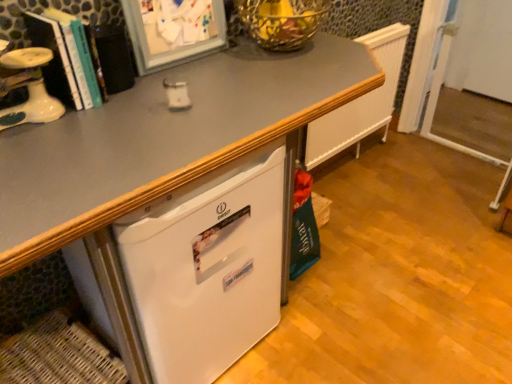
Locate an element on the screen. The width and height of the screenshot is (512, 384). white glossy desk at center is located at coordinates (162, 139).

What do you see at coordinates (162, 139) in the screenshot? The height and width of the screenshot is (384, 512). I see `white glossy desk at center` at bounding box center [162, 139].

Locate an element on the screen. The height and width of the screenshot is (384, 512). white plastic screen door at right is located at coordinates (474, 83).

The image size is (512, 384). Find the location of `white textured radiator at upper right`. white textured radiator at upper right is located at coordinates (361, 102).

Measure the distance between point (386, 62) and camera.

Point (386, 62) and camera are 7.99 feet apart.

Find the location of `white glossy desk at center`. white glossy desk at center is located at coordinates (162, 139).

Which is behind, white plastic screen door at right or white textured radiator at upper right?

white plastic screen door at right.

Consider the image. Is white plastic screen door at right surrounding white textured radiator at upper right?

That's incorrect, white textured radiator at upper right is not inside white plastic screen door at right.

Does point (498, 94) appear closer or farther from the camera than point (334, 139)?

Point (498, 94) is farther from the camera than point (334, 139).

Is white plastic screen door at right at the right side of white textured radiator at upper right?

Correct, you'll find white plastic screen door at right to the right of white textured radiator at upper right.

Measure the distance from white textured radiator at upper right to woven brown basket at lower left.

white textured radiator at upper right is 1.59 meters away from woven brown basket at lower left.

Is point (395, 54) closer to viewer compared to point (36, 376)?

No.

Considering the positions of objects white textured radiator at upper right and woven brown basket at lower left in the image provided, who is more to the right, white textured radiator at upper right or woven brown basket at lower left?

From the viewer's perspective, white textured radiator at upper right appears more on the right side.

Which of these two, white textured radiator at upper right or woven brown basket at lower left, is bigger?

white textured radiator at upper right is bigger.

Who is taller, woven brown basket at lower left or white plastic screen door at right?

Standing taller between the two is white plastic screen door at right.

Is woven brown basket at lower left touching white plastic screen door at right?

There is a gap between woven brown basket at lower left and white plastic screen door at right.

From the image's perspective, relative to white plastic screen door at right, is woven brown basket at lower left above or below?

Based on their image positions, woven brown basket at lower left is located beneath white plastic screen door at right.

Is white textured radiator at upper right taller than white plastic screen door at right?

Yes.

Looking at their sizes, would you say white textured radiator at upper right is wider or thinner than white plastic screen door at right?

Clearly, white textured radiator at upper right has more width compared to white plastic screen door at right.

Which is more to the left, white textured radiator at upper right or white plastic screen door at right?

white textured radiator at upper right.

Is white plastic screen door at right at the back of white textured radiator at upper right?

No, white plastic screen door at right is not at the back of white textured radiator at upper right.

Considering the positions of objects white plastic screen door at right and hardcover book at left in the image provided, who is more to the right, white plastic screen door at right or hardcover book at left?

white plastic screen door at right.

Is white plastic screen door at right positioned in front of hardcover book at left?

No, it is not.

Is white plastic screen door at right wider or thinner than hardcover book at left?

In the image, white plastic screen door at right appears to be more narrow than hardcover book at left.

Considering the relative positions of hardcover book at left and white glossy desk at center in the image provided, is hardcover book at left behind white glossy desk at center?

Yes, it is behind white glossy desk at center.

Would you consider hardcover book at left to be distant from white glossy desk at center?

Actually, hardcover book at left and white glossy desk at center are a little close together.

Identify the location of book that appears on the left of white glossy desk at center. Image resolution: width=512 pixels, height=384 pixels. (72, 61).

From the picture: How many degrees apart are the facing directions of hardcover book at left and white glossy desk at center?

The angle between the facing direction of hardcover book at left and the facing direction of white glossy desk at center is 0.227 degrees.

What's the angular difference between woven brown basket at lower left and white textured radiator at upper right's facing directions?

There is a 6.57-degree angle between the facing directions of woven brown basket at lower left and white textured radiator at upper right.

Identify the location of radiator above the woven brown basket at lower left (from a real-world perspective). The width and height of the screenshot is (512, 384). (361, 102).

Which is in front, point (82, 370) or point (384, 63)?

The point (82, 370) is more forward.

Would you say white textured radiator at upper right is part of woven brown basket at lower left's contents?

No, white textured radiator at upper right is located outside of woven brown basket at lower left.

At what (x,y) coordinates should I click in order to perform the action: click on screen door that appears behind the white textured radiator at upper right. Please return your answer as a coordinate pair (x, y). This screenshot has width=512, height=384. Looking at the image, I should click on (474, 83).

Where is `basket to the left of white textured radiator at upper right`? This screenshot has height=384, width=512. basket to the left of white textured radiator at upper right is located at coordinates (58, 355).

Based on their spatial positions, is hardcover book at left or white textured radiator at upper right further from woven brown basket at lower left?

Based on the image, white textured radiator at upper right appears to be further to woven brown basket at lower left.

Which object lies further to the anchor point hardcover book at left, woven brown basket at lower left or white plastic screen door at right?

Based on the image, white plastic screen door at right appears to be further to hardcover book at left.

When comparing their distances from white textured radiator at upper right, does white glossy desk at center or white plastic screen door at right seem closer?

white plastic screen door at right lies closer to white textured radiator at upper right than the other object.

Looking at the image, which one is located further to woven brown basket at lower left, white textured radiator at upper right or white matte refrigerator at lower left?

Among the two, white textured radiator at upper right is located further to woven brown basket at lower left.

Estimate the real-world distances between objects in this image. Which object is further from white plastic screen door at right, white matte refrigerator at lower left or woven brown basket at lower left?

woven brown basket at lower left is further to white plastic screen door at right.

In the scene shown: From the image, which object appears to be nearer to woven brown basket at lower left, white matte refrigerator at lower left or hardcover book at left?

white matte refrigerator at lower left is closer to woven brown basket at lower left.

Estimate the real-world distances between objects in this image. Which object is closer to white matte refrigerator at lower left, hardcover book at left or white plastic screen door at right?

hardcover book at left is positioned closer to the anchor white matte refrigerator at lower left.

Looking at the image, which one is located further to hardcover book at left, white textured radiator at upper right or white plastic screen door at right?

white plastic screen door at right is further to hardcover book at left.

Where is `refrigerator between white glossy desk at center and white textured radiator at upper right along the z-axis`? The height and width of the screenshot is (384, 512). refrigerator between white glossy desk at center and white textured radiator at upper right along the z-axis is located at coordinates (207, 267).

You are a GUI agent. You are given a task and a screenshot of the screen. Output one action in this format:
    pyautogui.click(x=<x>, y=<y>)
    Task: Click on the refrigerator between woven brown basket at lower left and white textured radiator at upper right in the horizontal direction
    The image size is (512, 384).
    Given the screenshot: What is the action you would take?
    pyautogui.click(x=207, y=267)

In order to click on desk between woven brown basket at lower left and white plastic screen door at right in this screenshot , I will do `click(162, 139)`.

Where is `radiator located between woven brown basket at lower left and white plastic screen door at right in the left-right direction`? This screenshot has height=384, width=512. radiator located between woven brown basket at lower left and white plastic screen door at right in the left-right direction is located at coordinates tap(361, 102).